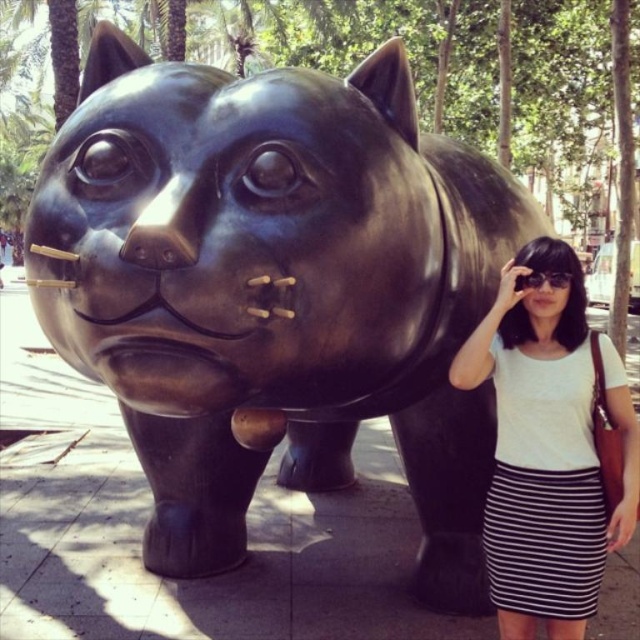
You are standing in front of the metallic cat sculpture and notice two points marked on its surface. The first point is at coordinates point (493, 536) and the second at point (540, 284). Which of these points is closer to your viewpoint?

Point (493, 536) is further to the camera than point (540, 284), so the point closer to your viewpoint is point (540, 284).

You are standing 10 feet away from the metallic sculpture of a cat. There is a specific point at coordinates point (625, 483) on the sculpture. Can you reach this point without moving closer than 7.94 feet to it?

The distance of point (625, 483) from viewer is 7.94 feet. Since you are currently 10 feet away from the sculpture, you need to move closer by 2.06 feet to reach the point. However, moving closer than 7.94 feet would allow you to touch it, so you can reach it by moving to 7.94 feet distance.